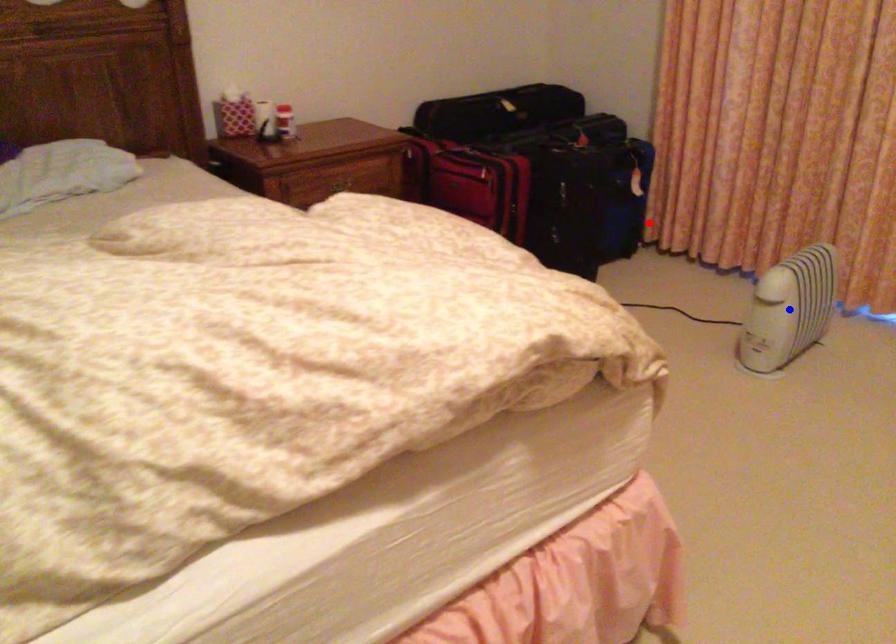
Question: In the image, two points are highlighted. Which point is nearer to the camera? Reply with the corresponding letter.

Choices:
 (A) blue point
 (B) red point

Answer: (A)